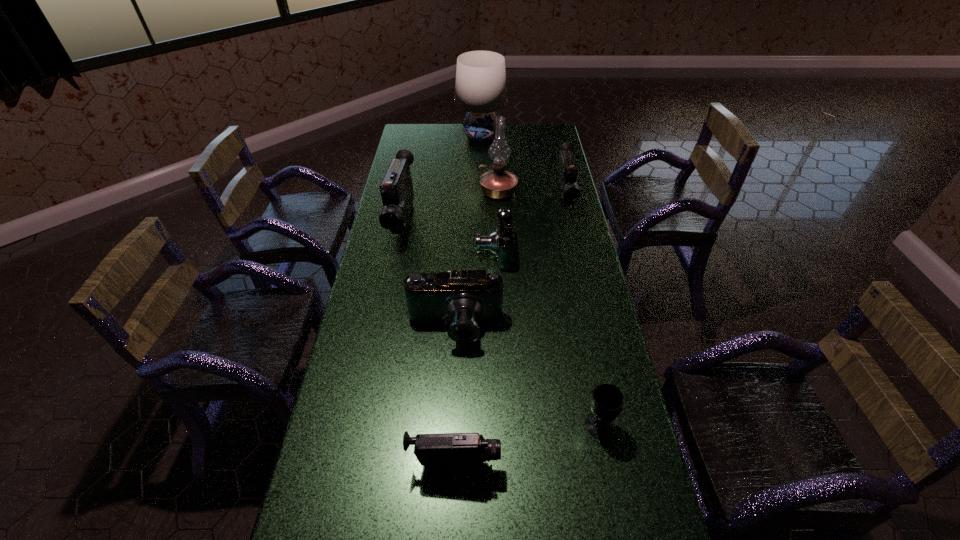
Select which object is the third closest to the lampshade. Please provide its 2D coordinates. Your answer should be formatted as a tuple, i.e. [(x, y)], where the tuple contains the x and y coordinates of a point satisfying the conditions above.

[(396, 188)]

The width and height of the screenshot is (960, 540). What are the coordinates of `camcorder that is the third closest to the farther blue camcorder` in the screenshot? It's located at coord(396,188).

The height and width of the screenshot is (540, 960). Identify the location of camcorder identified as the second closest to the oil lamp. (501, 242).

Where is `the second closest black camcorder to the second black camcorder from left to right`? the second closest black camcorder to the second black camcorder from left to right is located at coordinates (567, 174).

Identify the location of the closest black camcorder to the nearest object. The width and height of the screenshot is (960, 540). (396, 188).

I want to click on vacant region that satisfies the following two spatial constraints: 1. on the front-facing side of the smaller blue camcorder; 2. on the left side of the seventh farthest object, so click(x=499, y=426).

Identify the location of free spot that satisfies the following two spatial constraints: 1. on the front-facing side of the tallest camcorder; 2. on the right side of the chalice. (362, 426).

The width and height of the screenshot is (960, 540). I want to click on vacant position in the image that satisfies the following two spatial constraints: 1. on the front side of the seventh farthest object; 2. on the front-facing side of the nearest black camcorder, so click(607, 464).